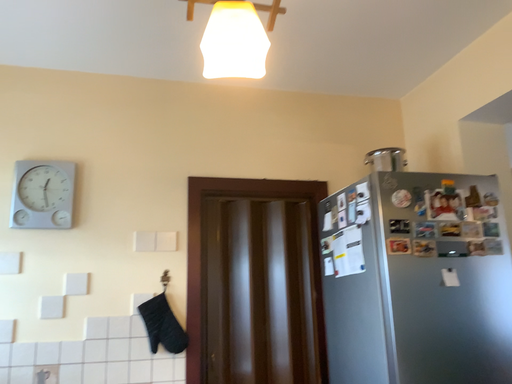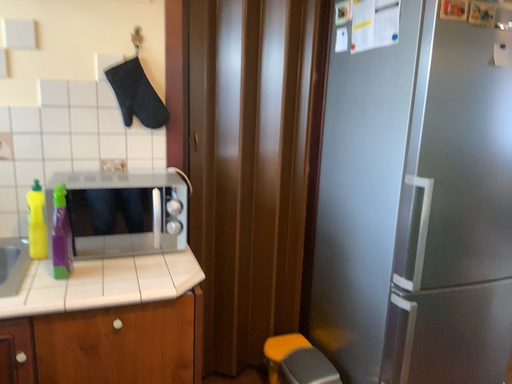
Question: How did the camera likely rotate when shooting the video?

Choices:
 (A) rotated downward
 (B) rotated upward

Answer: (A)